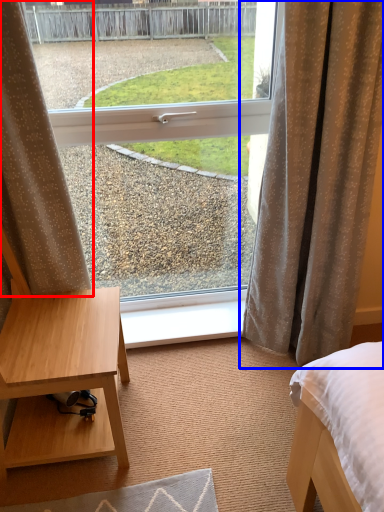
Question: Which point is closer to the camera, curtain (highlighted by a red box) or curtain (highlighted by a blue box)?

Choices:
 (A) curtain
 (B) curtain

Answer: (A)